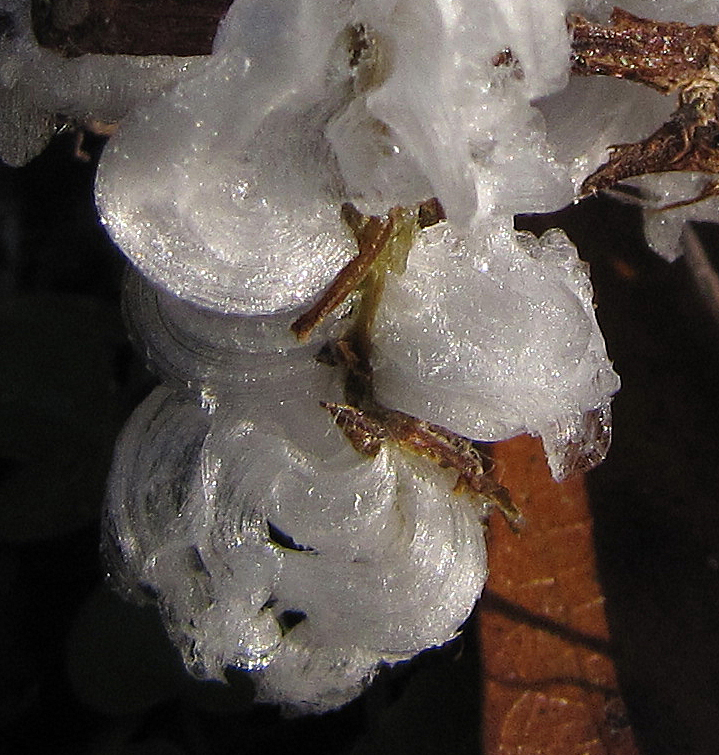
Where is `floor`? floor is located at coordinates (551, 581).